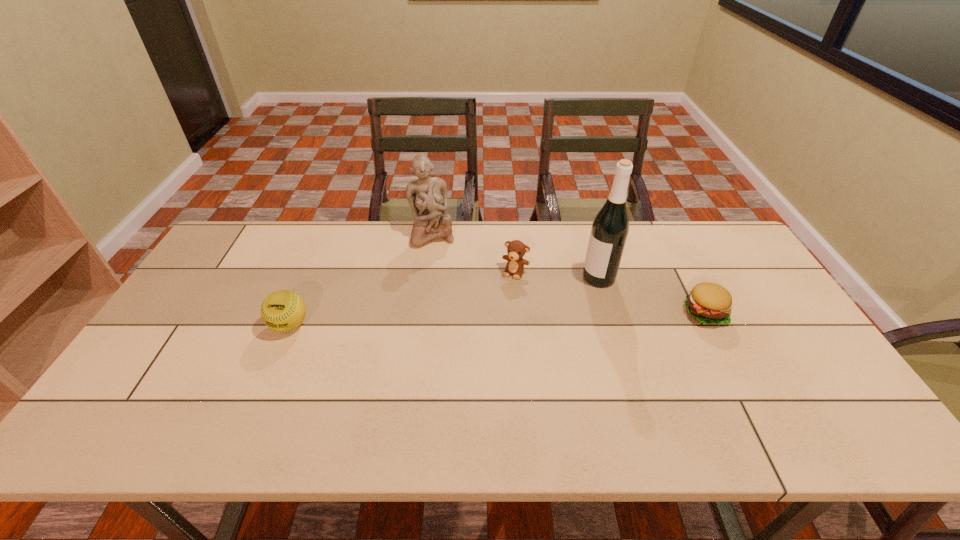
Locate an element on the screen. vacant space on the desktop that is between the softball and the rightmost object and is positioned on the face of the teddy bear is located at coordinates (491, 319).

Where is `vacant spot on the desktop that is between the leftmost object and the hamburger and is positioned on the label of the fourth object from left to right`? vacant spot on the desktop that is between the leftmost object and the hamburger and is positioned on the label of the fourth object from left to right is located at coordinates (527, 318).

Find the location of a particular element. vacant space on the desktop that is between the leftmost object and the hamburger and is positioned on the front-facing side of the fourth object from right to left is located at coordinates (454, 320).